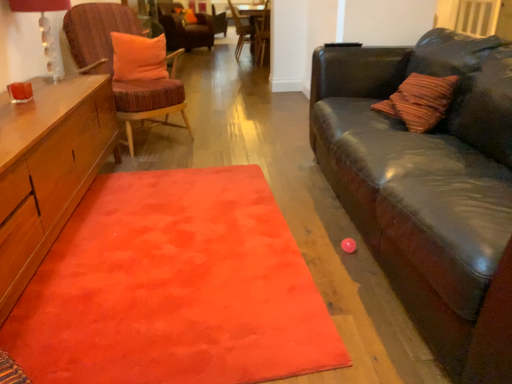
Describe the element at coordinates (138, 57) in the screenshot. I see `orange plush pillow at upper left, the 2th pillow in the top-to-bottom sequence` at that location.

Where is `orange plush pillow at upper left, the second pillow viewed from the back`? This screenshot has height=384, width=512. orange plush pillow at upper left, the second pillow viewed from the back is located at coordinates (138, 57).

In order to face matte glass lampshade at upper left, should I rotate leftwards or rightwards?

It's best to rotate left around 26.015 degrees.

The height and width of the screenshot is (384, 512). In order to click on wooden textured chair at upper center, positioned as the third chair in front-to-back order in this screenshot , I will do `click(240, 30)`.

This screenshot has width=512, height=384. What do you see at coordinates (185, 29) in the screenshot?
I see `velvet orange cushion at upper center, which is the 4th chair in front-to-back order` at bounding box center [185, 29].

You are a GUI agent. You are given a task and a screenshot of the screen. Output one action in this format:
    pyautogui.click(x=<x>, y=<y>)
    Task: Click on the orange plush pillow at upper left, the second pillow viewed from the back
    This screenshot has width=512, height=384.
    Given the screenshot: What is the action you would take?
    pyautogui.click(x=138, y=57)

Is orange fabric pillow at upper center, placed as the first pillow when sorted from left to right, facing away from orange soft rug at center?

No, orange fabric pillow at upper center, placed as the first pillow when sorted from left to right,'s orientation is not away from orange soft rug at center.

Can you tell me how much orange fabric pillow at upper center, which is counted as the 1th pillow, starting from the back, and orange soft rug at center differ in facing direction?

orange fabric pillow at upper center, which is counted as the 1th pillow, starting from the back, and orange soft rug at center are facing 67.8 degrees away from each other.

Who is bigger, orange fabric pillow at upper center, which is the first pillow from top to bottom, or orange soft rug at center?

Bigger between the two is orange soft rug at center.

From a real-world perspective, which is physically above, orange fabric pillow at upper center, which is the first pillow from top to bottom, or orange soft rug at center?

From a 3D spatial view, orange fabric pillow at upper center, which is the first pillow from top to bottom, is above.

Where is `pillow that appears in front of the wooden textured chair at upper center, which is counted as the 2th chair, starting from the back`? The image size is (512, 384). pillow that appears in front of the wooden textured chair at upper center, which is counted as the 2th chair, starting from the back is located at coordinates (138, 57).

Between wooden textured chair at upper center, positioned as the third chair in front-to-back order, and orange plush pillow at upper left, the second pillow viewed from the back, which one has smaller width?

With smaller width is orange plush pillow at upper left, the second pillow viewed from the back.

From the image's perspective, is wooden textured chair at upper center, which is counted as the 2th chair, starting from the back, positioned above or below orange plush pillow at upper left, which appears as the 2th pillow when viewed from the left?

From the image's perspective, wooden textured chair at upper center, which is counted as the 2th chair, starting from the back, appears above orange plush pillow at upper left, which appears as the 2th pillow when viewed from the left.

Is orange fabric pillow at upper center, which is the first pillow from top to bottom, facing away from velvet orange cushion at upper center, the 1th chair when ordered from back to front?

Yes, orange fabric pillow at upper center, which is the first pillow from top to bottom, is facing away from velvet orange cushion at upper center, the 1th chair when ordered from back to front.

Is orange fabric pillow at upper center, which is counted as the second pillow, starting from the bottom, located outside velvet orange cushion at upper center, which is the 4th chair in front-to-back order?

No, orange fabric pillow at upper center, which is counted as the second pillow, starting from the bottom, is not outside of velvet orange cushion at upper center, which is the 4th chair in front-to-back order.

Does orange fabric pillow at upper center, which is counted as the 1th pillow, starting from the back, appear on the right side of velvet orange cushion at upper center, the 1th chair when ordered from back to front?

Indeed, orange fabric pillow at upper center, which is counted as the 1th pillow, starting from the back, is positioned on the right side of velvet orange cushion at upper center, the 1th chair when ordered from back to front.

From a real-world perspective, is orange fabric pillow at upper center, the second pillow viewed from the front, above or below velvet orange cushion at upper center, which is the 4th chair in front-to-back order?

orange fabric pillow at upper center, the second pillow viewed from the front, is situated higher than velvet orange cushion at upper center, which is the 4th chair in front-to-back order, in the real world.

Relative to wooden textured chair at upper center, positioned as the third chair in front-to-back order, is matte glass lampshade at upper left in front or behind?

matte glass lampshade at upper left is in front of wooden textured chair at upper center, positioned as the third chair in front-to-back order.

Is wooden textured chair at upper center, which is counted as the 2th chair, starting from the back, inside matte glass lampshade at upper left?

No, wooden textured chair at upper center, which is counted as the 2th chair, starting from the back, is not a part of matte glass lampshade at upper left.

Is matte glass lampshade at upper left far away from wooden textured chair at upper center, positioned as the third chair in front-to-back order?

Yes.

Identify the location of lamp in front of the wooden textured chair at upper center, which is counted as the 2th chair, starting from the back. (44, 27).

Is point (253, 47) less distant than point (190, 27)?

Yes, point (253, 47) is closer to viewer.

Can you confirm if wooden chair at center, the 3th chair in the back-to-front sequence, is positioned to the left of velvet orange cushion at upper center, the 1th chair when ordered from back to front?

No, wooden chair at center, the 3th chair in the back-to-front sequence, is not to the left of velvet orange cushion at upper center, the 1th chair when ordered from back to front.

Looking at their sizes, would you say wooden chair at center, the 3th chair in the back-to-front sequence, is wider or thinner than velvet orange cushion at upper center, which is the 4th chair in front-to-back order?

wooden chair at center, the 3th chair in the back-to-front sequence, is thinner than velvet orange cushion at upper center, which is the 4th chair in front-to-back order.

Is velvet orange cushion at upper center, which is the 4th chair in front-to-back order, a part of wooden chair at center, which is the second chair from front to back?

That's incorrect, velvet orange cushion at upper center, which is the 4th chair in front-to-back order, is not inside wooden chair at center, which is the second chair from front to back.

Where is `chair that is the 2nd object located above the orange plush pillow at upper left, which is counted as the first pillow, starting from the bottom (from the image's perspective)`? This screenshot has height=384, width=512. chair that is the 2nd object located above the orange plush pillow at upper left, which is counted as the first pillow, starting from the bottom (from the image's perspective) is located at coordinates (240, 30).

From a real-world perspective, is orange plush pillow at upper left, which appears as the 2th pillow when viewed from the left, physically located above or below wooden textured chair at upper center, positioned as the third chair in front-to-back order?

From a real-world perspective, orange plush pillow at upper left, which appears as the 2th pillow when viewed from the left, is physically above wooden textured chair at upper center, positioned as the third chair in front-to-back order.

From the picture: Does orange plush pillow at upper left, which ranks as the first pillow in right-to-left order, have a greater height compared to wooden textured chair at upper center, which is counted as the 2th chair, starting from the back?

Incorrect, the height of orange plush pillow at upper left, which ranks as the first pillow in right-to-left order, is not larger of that of wooden textured chair at upper center, which is counted as the 2th chair, starting from the back.

Is orange plush pillow at upper left, placed as the first pillow when sorted from front to back, at the left side of wooden textured chair at upper center, which is counted as the 2th chair, starting from the back?

Indeed, orange plush pillow at upper left, placed as the first pillow when sorted from front to back, is positioned on the left side of wooden textured chair at upper center, which is counted as the 2th chair, starting from the back.

Who is smaller, orange plush pillow at upper left, which appears as the 2th pillow when viewed from the left, or matte glass lampshade at upper left?

orange plush pillow at upper left, which appears as the 2th pillow when viewed from the left, is smaller.

Between orange plush pillow at upper left, placed as the first pillow when sorted from front to back, and matte glass lampshade at upper left, which one has smaller width?

With smaller width is orange plush pillow at upper left, placed as the first pillow when sorted from front to back.

Is orange plush pillow at upper left, which ranks as the first pillow in right-to-left order, in contact with matte glass lampshade at upper left?

They are not placed beside each other.

Is orange plush pillow at upper left, the second pillow viewed from the back, looking in the opposite direction of matte glass lampshade at upper left?

orange plush pillow at upper left, the second pillow viewed from the back, does not have its back to matte glass lampshade at upper left.

Which pillow is the 2nd one when counting from the back of the orange soft rug at center? Please provide its 2D coordinates.

[(188, 16)]

From the image's perspective, starting from the orange plush pillow at upper left, which ranks as the first pillow in right-to-left order, which chair is the 2nd one above? Please provide its 2D coordinates.

[(240, 30)]

Looking at the image, which one is located further to orange soft rug at center, orange fabric pillow at upper center, which is counted as the 1th pillow, starting from the back, or wooden textured chair at upper center, positioned as the third chair in front-to-back order?

orange fabric pillow at upper center, which is counted as the 1th pillow, starting from the back, is positioned further to the anchor orange soft rug at center.

In the scene shown: Which object lies further to the anchor point orange plush pillow at upper left, placed as the first pillow when sorted from front to back, orange fabric pillow at upper center, the second pillow viewed from the front, or woven wood chair with orange cushion at left, the first chair when ordered from front to back?

orange fabric pillow at upper center, the second pillow viewed from the front.

From the image, which object appears to be farther from orange fabric pillow at upper center, which is the first pillow from top to bottom, wooden chair at center, the 3th chair in the back-to-front sequence, or woven wood chair with orange cushion at left, arranged as the 4th chair when viewed from the back?

woven wood chair with orange cushion at left, arranged as the 4th chair when viewed from the back.

From the image, which object appears to be nearer to wooden textured chair at upper center, which is counted as the 2th chair, starting from the back, orange soft rug at center or velvet orange cushion at upper center, the 1th chair when ordered from back to front?

velvet orange cushion at upper center, the 1th chair when ordered from back to front.

Based on their spatial positions, is woven wood chair with orange cushion at left, arranged as the 4th chair when viewed from the back, or wooden side table at center further from orange fabric pillow at upper center, which is counted as the 1th pillow, starting from the back?

woven wood chair with orange cushion at left, arranged as the 4th chair when viewed from the back, lies further to orange fabric pillow at upper center, which is counted as the 1th pillow, starting from the back, than the other object.

When comparing their distances from orange soft rug at center, does matte glass lampshade at upper left or velvet orange cushion at upper center, the 1th chair when ordered from back to front, seem closer?

matte glass lampshade at upper left lies closer to orange soft rug at center than the other object.

Considering their positions, is wooden chair at center, the 3th chair in the back-to-front sequence, positioned further to orange plush pillow at upper left, the second pillow viewed from the back, than wooden textured chair at upper center, which is counted as the 2th chair, starting from the back?

wooden textured chair at upper center, which is counted as the 2th chair, starting from the back, is further to orange plush pillow at upper left, the second pillow viewed from the back.

Based on their spatial positions, is velvet orange cushion at upper center, the 1th chair when ordered from back to front, or wooden textured chair at upper center, which is counted as the 2th chair, starting from the back, further from matte glass lampshade at upper left?

wooden textured chair at upper center, which is counted as the 2th chair, starting from the back, is further to matte glass lampshade at upper left.

Locate an element on the screen. The height and width of the screenshot is (384, 512). lamp between orange soft rug at center and wooden side table at center in the front-back direction is located at coordinates (44, 27).

Where is `chair between orange plush pillow at upper left, which is counted as the first pillow, starting from the bottom, and wooden textured chair at upper center, positioned as the third chair in front-to-back order, along the z-axis`? The width and height of the screenshot is (512, 384). chair between orange plush pillow at upper left, which is counted as the first pillow, starting from the bottom, and wooden textured chair at upper center, positioned as the third chair in front-to-back order, along the z-axis is located at coordinates (260, 33).

Identify the location of lamp between orange soft rug at center and wooden chair at center, which is the second chair from front to back, along the z-axis. (44, 27).

At what (x,y) coordinates should I click in order to perform the action: click on side table between matte glass lampshade at upper left and orange fabric pillow at upper center, the second pillow viewed from the front, in the front-back direction. Please return your answer as a coordinate pair (x, y). This screenshot has width=512, height=384. Looking at the image, I should click on (254, 10).